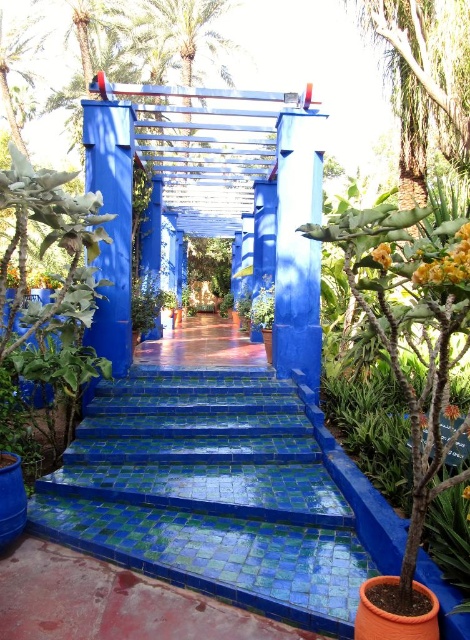
You are a gardener who wants to install a new light fixture. You have two options to choose from. The first option is to place it on the blue mosaic tile stairs at center, and the second option is to place it on the green leafy palm tree at upper center. Which location would allow the light fixture to be taller when installed?

The green leafy palm tree at upper center is taller than the blue mosaic tile stairs at center, so placing the light fixture on the green leafy palm tree at upper center would make it taller.

You are standing at the entrance of the garden and want to reach the blue pergola. According to the image, where are the blue mosaic tile stairs at center located in terms of their 2D coordinates?

The blue mosaic tile stairs at center are located at the 2D coordinates point [211,493].